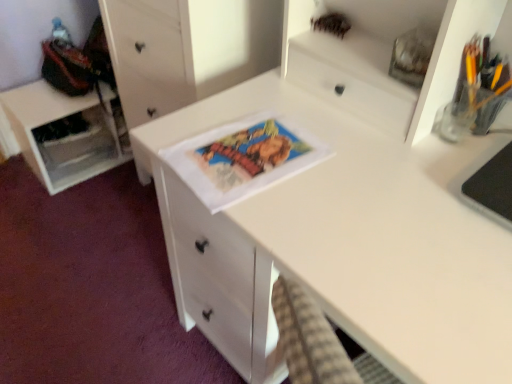
Question: Can you confirm if matte paper comic book at center is bigger than white matte cabinet at left?

Choices:
 (A) no
 (B) yes

Answer: (A)

Question: Is matte paper comic book at center not near white matte cabinet at left?

Choices:
 (A) yes
 (B) no

Answer: (A)

Question: Is matte paper comic book at center smaller than white matte cabinet at left?

Choices:
 (A) no
 (B) yes

Answer: (B)

Question: Is matte paper comic book at center aimed at white matte cabinet at left?

Choices:
 (A) yes
 (B) no

Answer: (B)

Question: Is the depth of matte paper comic book at center less than that of white matte cabinet at left?

Choices:
 (A) no
 (B) yes

Answer: (B)

Question: Visually, is white matte chest of drawers at center positioned to the left or to the right of translucent glass pencil holder at upper right?

Choices:
 (A) right
 (B) left

Answer: (B)

Question: Is white matte chest of drawers at center taller or shorter than translucent glass pencil holder at upper right?

Choices:
 (A) short
 (B) tall

Answer: (B)

Question: Is white matte chest of drawers at center in front of or behind translucent glass pencil holder at upper right in the image?

Choices:
 (A) front
 (B) behind

Answer: (B)

Question: Looking at their shapes, would you say white matte chest of drawers at center is wider or thinner than translucent glass pencil holder at upper right?

Choices:
 (A) wide
 (B) thin

Answer: (A)

Question: From the image's perspective, is white matte desk at center positioned above or below white matte cabinet at left?

Choices:
 (A) below
 (B) above

Answer: (A)

Question: Based on their positions, is white matte desk at center located to the left or right of white matte cabinet at left?

Choices:
 (A) right
 (B) left

Answer: (A)

Question: In terms of size, does white matte desk at center appear bigger or smaller than white matte cabinet at left?

Choices:
 (A) big
 (B) small

Answer: (A)

Question: From their relative heights in the image, would you say white matte desk at center is taller or shorter than white matte cabinet at left?

Choices:
 (A) tall
 (B) short

Answer: (A)

Question: Is point (468, 71) positioned closer to the camera than point (286, 137)?

Choices:
 (A) farther
 (B) closer

Answer: (B)

Question: Considering the positions of translucent glass pencil holder at upper right and matte paper comic book at center in the image, is translucent glass pencil holder at upper right taller or shorter than matte paper comic book at center?

Choices:
 (A) tall
 (B) short

Answer: (A)